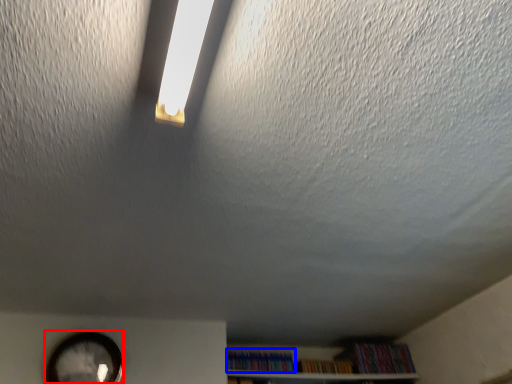
Question: Which object is further to the camera taking this photo, clock (highlighted by a red box) or book (highlighted by a blue box)?

Choices:
 (A) clock
 (B) book

Answer: (B)